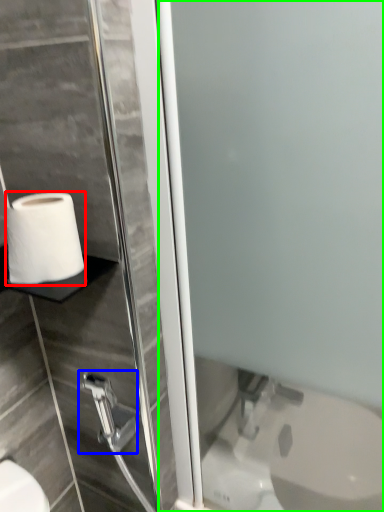
Question: Which object is positioned closest to toilet paper (highlighted by a red box)? Select from shower (highlighted by a blue box) and screen door (highlighted by a green box).

Choices:
 (A) shower
 (B) screen door

Answer: (B)